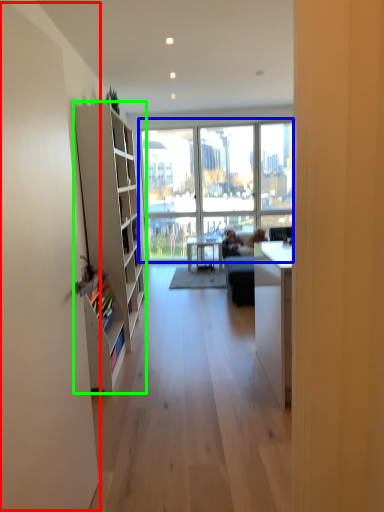
Question: Considering the real-world distances, which object is farthest from screen door (highlighted by a red box)? window (highlighted by a blue box) or cabinet (highlighted by a green box)?

Choices:
 (A) window
 (B) cabinet

Answer: (A)